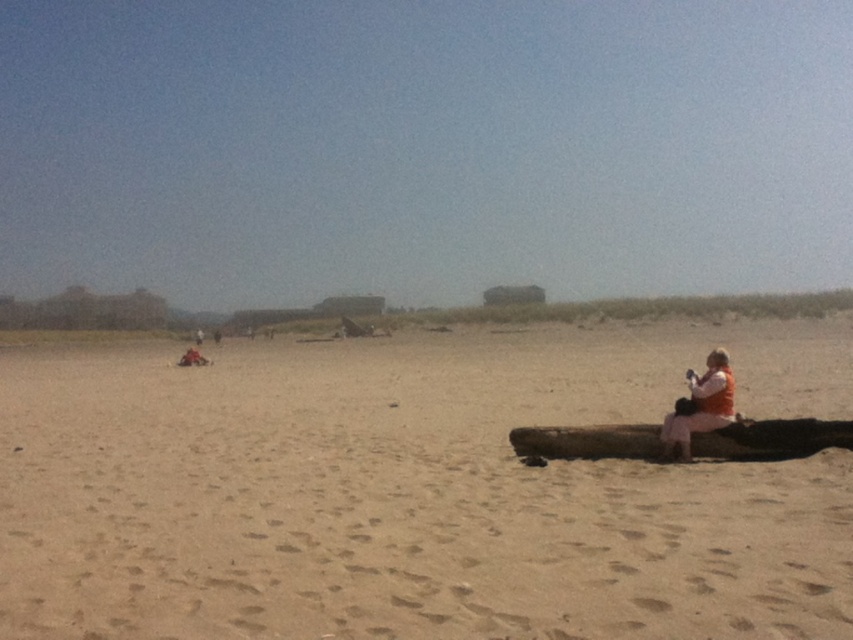
You are a photographer standing on the beach and want to take a photo of the smooth sand at lower right and the brown wood log at lower right. Which object should you focus on first if you want to capture both in the same frame without moving the camera?

The smooth sand at lower right is in front of the brown wood log at lower right, so you should focus on the smooth sand at lower right first to ensure both are in focus.

Based on the photo, you are a photographer trying to capture the brown wood log at lower right and the smooth sand at lower right in the same frame. Based on their positions, which object is closer to the camera?

The smooth sand at lower right is positioned over the brown wood log at lower right, meaning the smooth sand at lower right is closer to the camera.